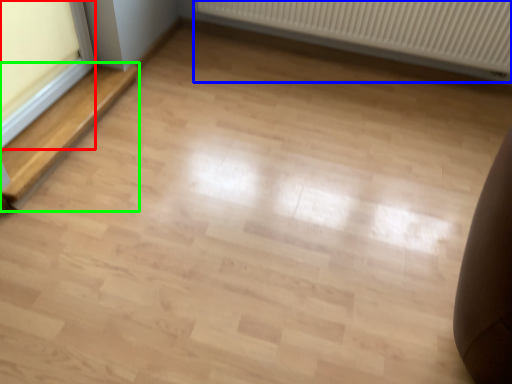
Question: Which object is positioned farthest from window frame (highlighted by a red box)? Select from radiator (highlighted by a blue box) and stairwell (highlighted by a green box).

Choices:
 (A) radiator
 (B) stairwell

Answer: (A)